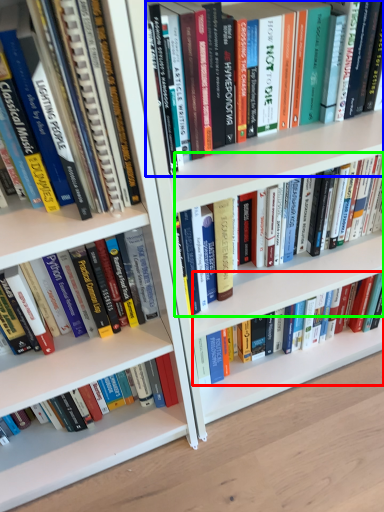
Question: Which object is the closest to the book (highlighted by a red box)? Choose among these: book (highlighted by a blue box) or book (highlighted by a green box).

Choices:
 (A) book
 (B) book

Answer: (B)